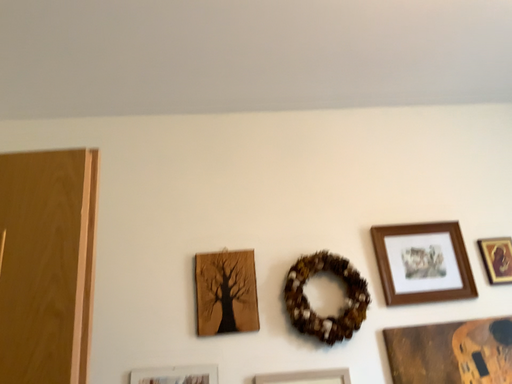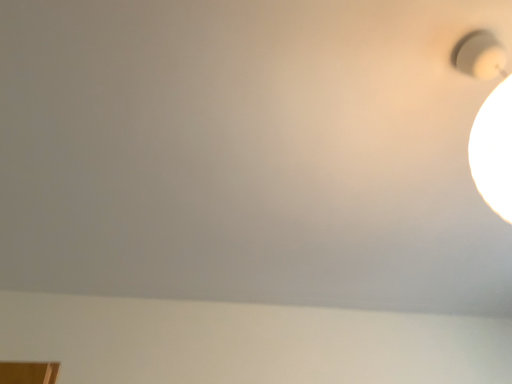
Question: Which way did the camera rotate in the video?

Choices:
 (A) rotated right
 (B) rotated left

Answer: (A)